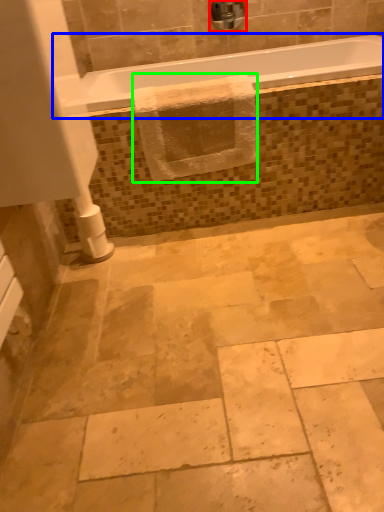
Question: Which is nearer to the faucet (highlighted by a red box)? bathtub (highlighted by a blue box) or bath towel (highlighted by a green box).

Choices:
 (A) bathtub
 (B) bath towel

Answer: (A)